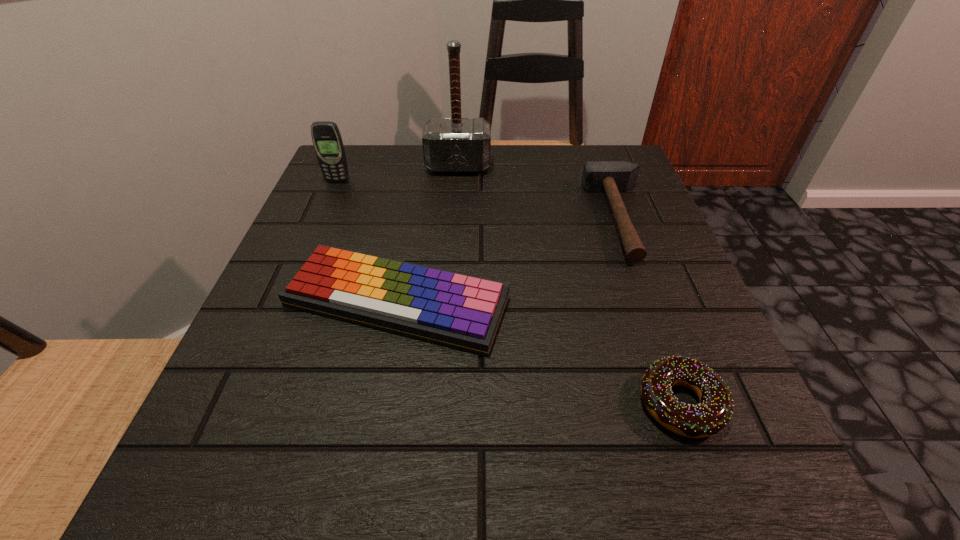
Find the location of a particular element. This screenshot has width=960, height=540. vacant point located between the computer keyboard and the cellular telephone is located at coordinates (367, 242).

Identify the location of free spot between the computer keyboard and the doughnut. This screenshot has width=960, height=540. (539, 353).

The height and width of the screenshot is (540, 960). In order to click on free point between the fourth shortest object and the computer keyboard in this screenshot , I will do `click(367, 242)`.

Where is `free spot between the left hammer and the nearer hammer`? The width and height of the screenshot is (960, 540). free spot between the left hammer and the nearer hammer is located at coordinates [540, 192].

Find the location of `free space that is in between the cellular telephone and the right hammer`. free space that is in between the cellular telephone and the right hammer is located at coordinates (480, 200).

Where is `free space between the shorter hammer and the fourth shortest object`? Image resolution: width=960 pixels, height=540 pixels. free space between the shorter hammer and the fourth shortest object is located at coordinates (480, 200).

Find the location of a particular element. The height and width of the screenshot is (540, 960). free area in between the taller hammer and the cellular telephone is located at coordinates (398, 174).

Identify the location of blank region between the shorter hammer and the nearest object. The height and width of the screenshot is (540, 960). (651, 311).

Image resolution: width=960 pixels, height=540 pixels. What are the coordinates of `vacant space that's between the computer keyboard and the doughnut` in the screenshot? It's located at (539, 353).

Locate an element on the screen. object that is the closest to the shorter hammer is located at coordinates click(461, 311).